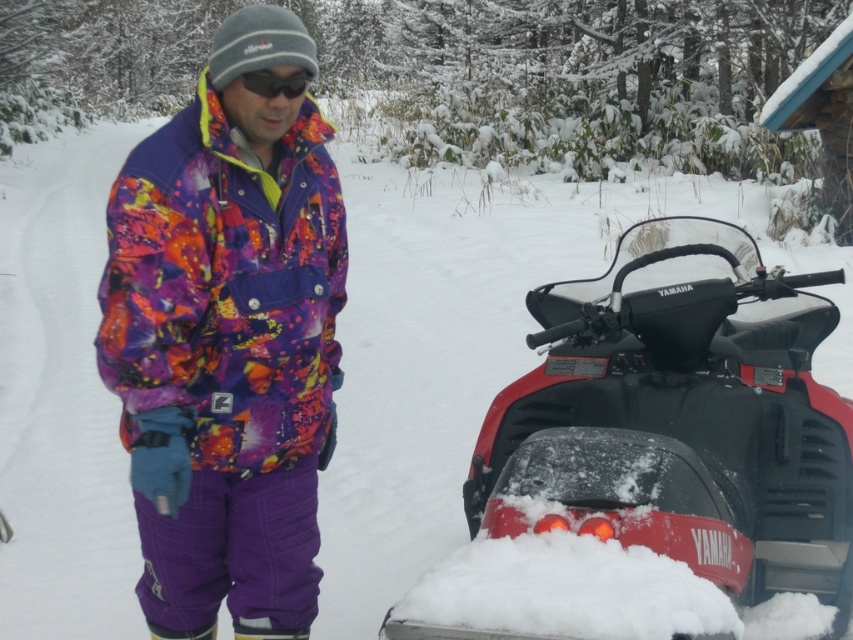
Can you confirm if floral-patterned jacket at center is smaller than purple synthetic ski boot at lower center?

No.

Consider the image. Is floral-patterned jacket at center wider than purple synthetic ski boot at lower center?

Correct, the width of floral-patterned jacket at center exceeds that of purple synthetic ski boot at lower center.

The image size is (853, 640). Identify the location of floral-patterned jacket at center. (228, 333).

The width and height of the screenshot is (853, 640). In order to click on floral-patterned jacket at center in this screenshot , I will do `click(228, 333)`.

Does point (245, 84) come in front of point (198, 637)?

Yes, point (245, 84) is in front of point (198, 637).

How far apart are black matte sunglasses at upper center and purple synthetic ski boot at lower center?

black matte sunglasses at upper center is 4.84 feet from purple synthetic ski boot at lower center.

This screenshot has width=853, height=640. Find the location of `black matte sunglasses at upper center`. black matte sunglasses at upper center is located at coordinates (276, 83).

Who is taller, red matte snowmobile at lower right or matte purple ski boot at lower center?

With more height is red matte snowmobile at lower right.

What are the coordinates of `red matte snowmobile at lower right` in the screenshot? It's located at (680, 419).